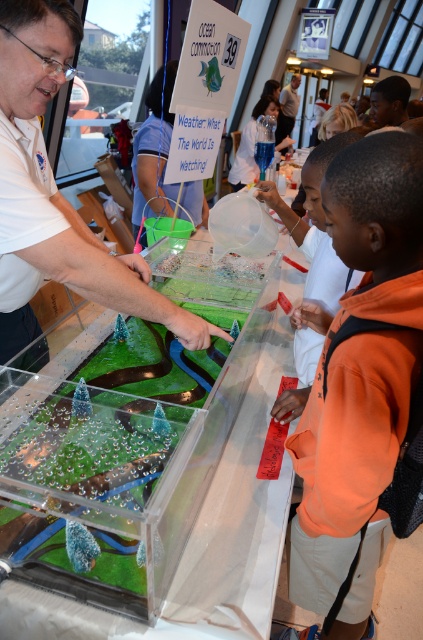
Can you confirm if orange fleece jacket at right is positioned to the right of matte white shirt at upper center?

Incorrect, orange fleece jacket at right is not on the right side of matte white shirt at upper center.

Is orange fleece jacket at right bigger than matte white shirt at upper center?

No.

Where is `orange fleece jacket at right`? orange fleece jacket at right is located at coordinates (359, 380).

Does orange fleece jacket at lower right appear on the left side of matte white shirt at upper center?

Correct, you'll find orange fleece jacket at lower right to the left of matte white shirt at upper center.

Is point (294, 332) closer to viewer compared to point (291, 77)?

Yes, point (294, 332) is in front of point (291, 77).

I want to click on orange fleece jacket at lower right, so click(x=312, y=272).

Is the position of matte white shirt at left more distant than that of orange fleece jacket at lower right?

No, it is in front of orange fleece jacket at lower right.

The height and width of the screenshot is (640, 423). I want to click on matte white shirt at left, so click(57, 193).